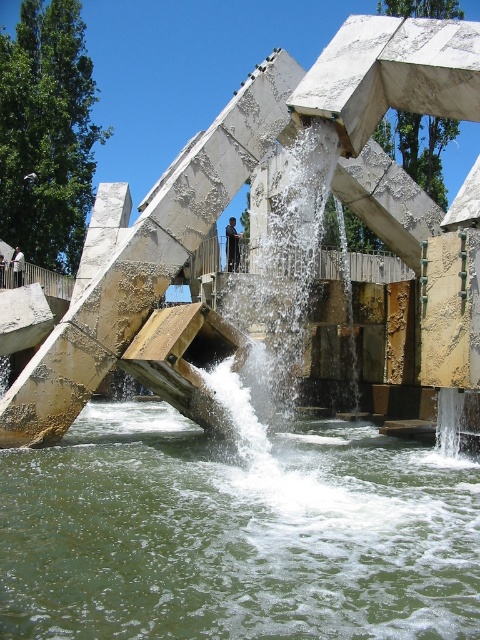
Question: Which point is closer to the camera?

Choices:
 (A) greenish water at center bottom
 (B) dark blue shirt at center
 (C) dark blue jeans at left

Answer: (A)

Question: Which point is farther to the camera?

Choices:
 (A) (98, 333)
 (B) (12, 266)

Answer: (B)

Question: Does white concrete dam at center appear over dark blue jeans at left?

Choices:
 (A) no
 (B) yes

Answer: (A)

Question: Does white concrete dam at center appear under dark blue shirt at center?

Choices:
 (A) yes
 (B) no

Answer: (A)

Question: Based on their relative distances, which object is farther from the white concrete dam at center?

Choices:
 (A) dark blue jeans at left
 (B) dark blue shirt at center

Answer: (A)

Question: Is greenish water at center bottom closer to camera compared to dark blue shirt at center?

Choices:
 (A) yes
 (B) no

Answer: (A)